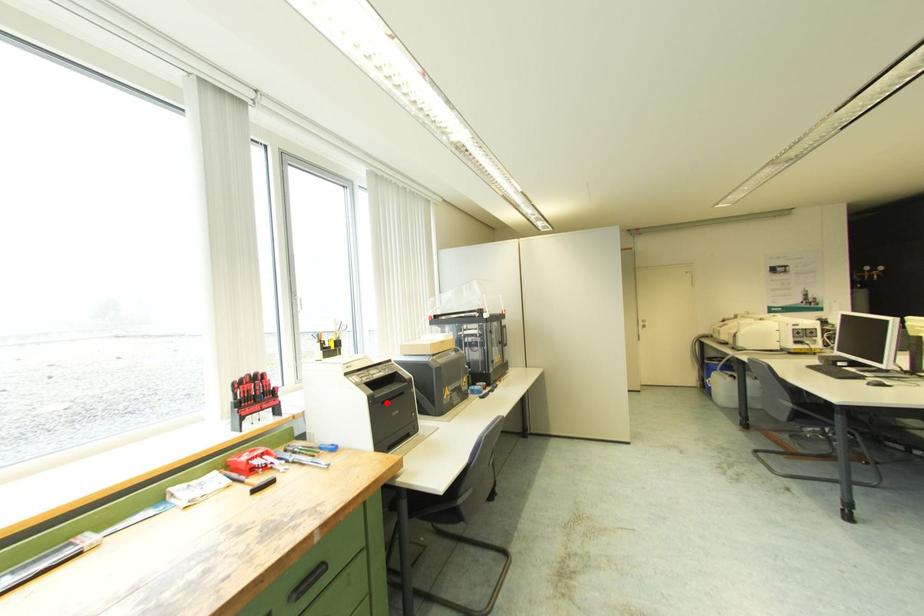
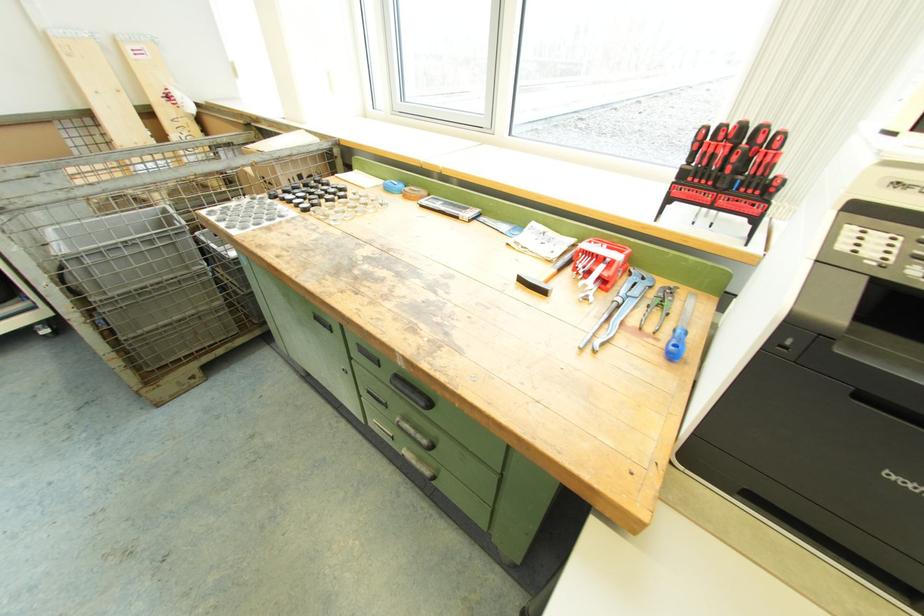
Where in the second image is the point corresponding to the highlighted location from the first image?

(867, 398)